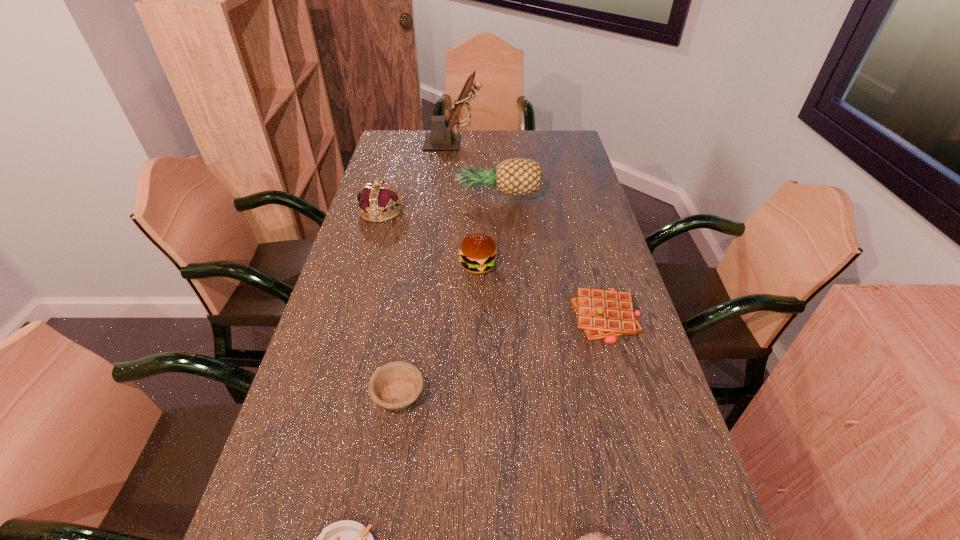
Identify the location of figurine. This screenshot has width=960, height=540. (441, 138).

I want to click on the farthest object, so click(441, 138).

This screenshot has width=960, height=540. What are the coordinates of `pineapple` in the screenshot? It's located at (515, 177).

What are the coordinates of `crown` in the screenshot? It's located at (379, 201).

Identify the location of the fifth shortest object. (478, 252).

Locate an element on the screen. This screenshot has height=540, width=960. the fourth farthest object is located at coordinates (478, 252).

Locate an element on the screen. The width and height of the screenshot is (960, 540). the fourth nearest object is located at coordinates (603, 314).

This screenshot has width=960, height=540. Identify the location of the rightmost object. (603, 314).

Where is `the sixth farthest object`? This screenshot has height=540, width=960. the sixth farthest object is located at coordinates (396, 385).

The width and height of the screenshot is (960, 540). I want to click on vacant point located 0.230m on the front-facing side of the farthest object, so click(536, 142).